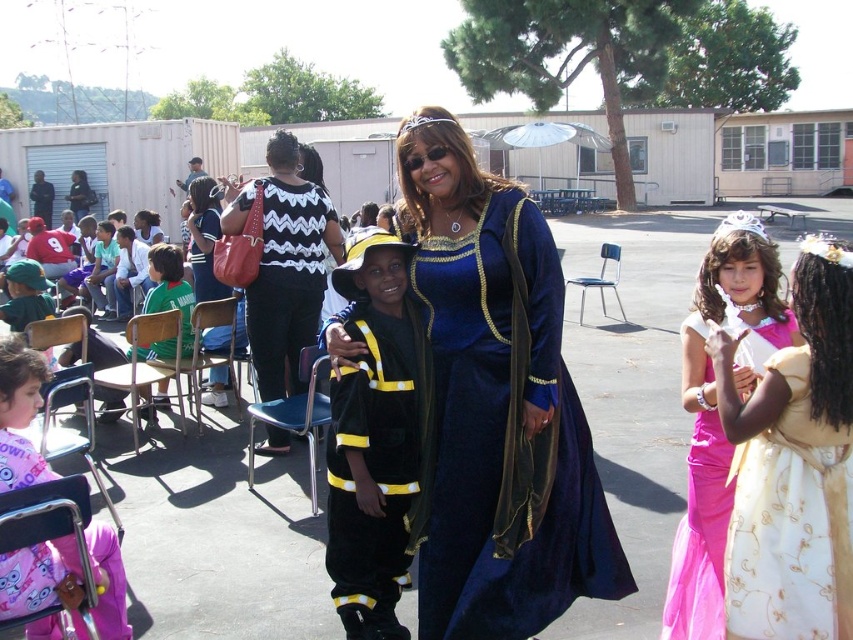
Is pink satin dress at center wider than pink fleece pants at lower left?

No, pink satin dress at center is not wider than pink fleece pants at lower left.

Can you confirm if pink satin dress at center is taller than pink fleece pants at lower left?

Correct, pink satin dress at center is much taller as pink fleece pants at lower left.

Is point (682, 577) more distant than point (59, 556)?

Yes, point (682, 577) is farther from viewer.

In order to click on pink satin dress at center in this screenshot , I will do `click(717, 413)`.

Is point (24, 552) positioned before point (212, 236)?

Yes.

You are a GUI agent. You are given a task and a screenshot of the screen. Output one action in this format:
    pyautogui.click(x=<x>, y=<y>)
    Task: Click on the pink fleece pants at lower left
    The image size is (853, 640).
    Given the screenshot: What is the action you would take?
    pyautogui.click(x=19, y=413)

Which is above, velvet blue dress at center or black zigzag sweater at center?

Positioned higher is black zigzag sweater at center.

Does point (589, 508) come behind point (283, 365)?

No, (589, 508) is in front of (283, 365).

Locate an element on the screen. velvet blue dress at center is located at coordinates (494, 404).